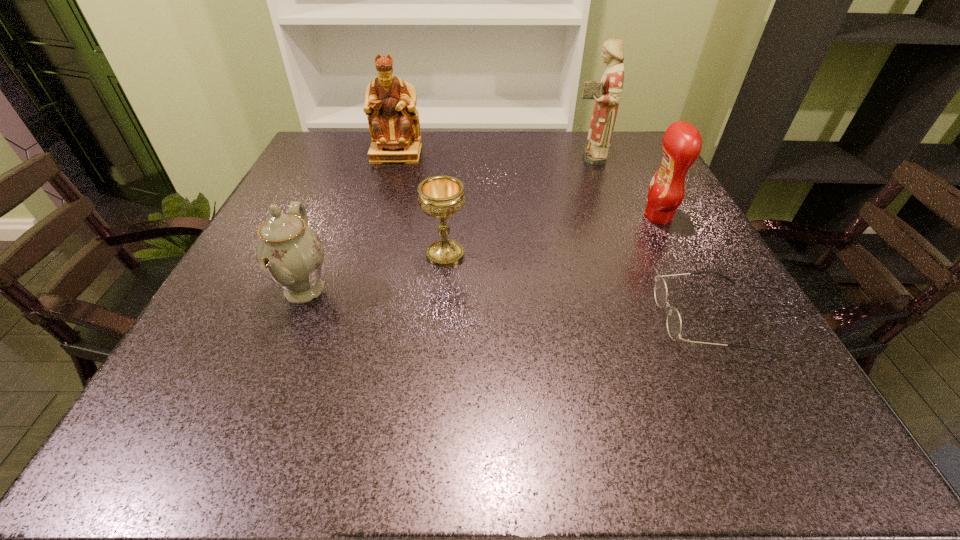
Where is `free spot located 0.400m on the front-facing side of the tallest object`? The width and height of the screenshot is (960, 540). free spot located 0.400m on the front-facing side of the tallest object is located at coordinates (419, 157).

You are a GUI agent. You are given a task and a screenshot of the screen. Output one action in this format:
    pyautogui.click(x=<x>, y=<y>)
    Task: Click on the vacant space located on the front-facing side of the tallest object
    Image resolution: width=960 pixels, height=540 pixels.
    Given the screenshot: What is the action you would take?
    pyautogui.click(x=434, y=157)

The width and height of the screenshot is (960, 540). In order to click on vacant area situated 0.300m on the front-facing side of the shorter figurine in this screenshot , I will do `click(372, 235)`.

Identify the location of vacant space located on the label side of the third farthest object. (533, 217).

This screenshot has height=540, width=960. In order to click on vacant space situated 0.370m on the label side of the third farthest object in this screenshot , I will do `click(473, 217)`.

Identify the location of free spot located on the label side of the third farthest object. The width and height of the screenshot is (960, 540). (496, 217).

Identify the location of vacant area located 0.150m on the spout of the chinaware. (417, 290).

Identify the location of vacant space located 0.100m on the back of the second shortest object. point(449,213).

At what (x,y) coordinates should I click in order to perform the action: click on free space located through the lenses of the spectacles. Please return your answer as a coordinate pair (x, y). The image size is (960, 540). Looking at the image, I should click on (459, 318).

At what (x,y) coordinates should I click in order to perform the action: click on vacant space situated 0.280m through the lenses of the spectacles. Please return your answer as a coordinate pair (x, y). Looking at the image, I should click on (494, 318).